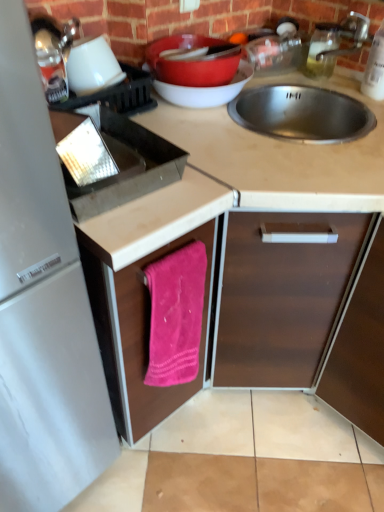
Where is `vacant space in front of clear glass bottle at upper right, the 1th bottle when ordered from left to right`? The height and width of the screenshot is (512, 384). vacant space in front of clear glass bottle at upper right, the 1th bottle when ordered from left to right is located at coordinates (329, 91).